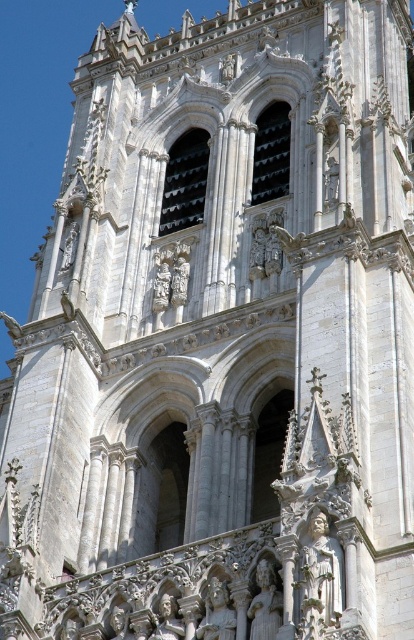
Looking at this image, who is higher up, white stone statue at lower center or white stone statue at center?

white stone statue at lower center is above.

The image size is (414, 640). I want to click on white stone statue at lower center, so click(319, 579).

Locate an element on the screen. white stone statue at lower center is located at coordinates (319, 579).

Who is lower down, white stone statue at lower center or polished silver statue at center?

polished silver statue at center is lower down.

At what (x,y) coordinates should I click in order to perform the action: click on white stone statue at lower center. Please return your answer as a coordinate pair (x, y). This screenshot has height=640, width=414. Looking at the image, I should click on (319, 579).

The image size is (414, 640). I want to click on white stone statue at lower center, so click(319, 579).

Between white stone statue at center and polished silver statue at center, which one is positioned higher?

white stone statue at center is above.

From the picture: Can you confirm if white stone statue at center is shorter than polished silver statue at center?

No.

Which is behind, point (276, 621) or point (154, 628)?

The point (154, 628) is more distant.

Locate an element on the screen. The height and width of the screenshot is (640, 414). white stone statue at center is located at coordinates coord(264,604).